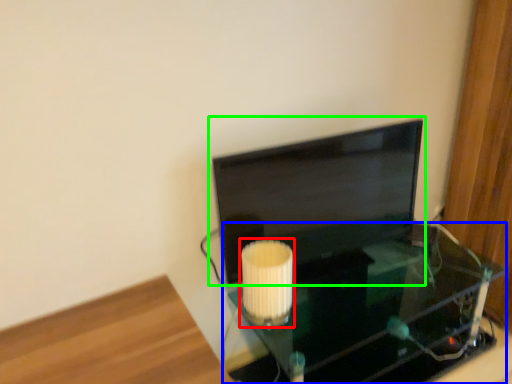
Question: Which is nearer to the lamp (highlighted by a red box)? table (highlighted by a blue box) or computer monitor (highlighted by a green box).

Choices:
 (A) table
 (B) computer monitor

Answer: (B)